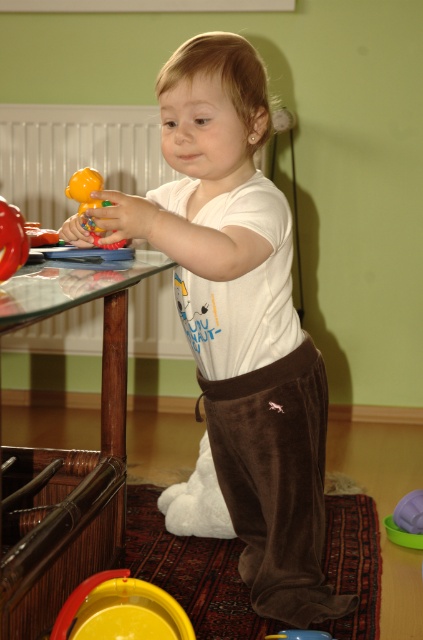
Question: Which point appears closest to the camera in this image?

Choices:
 (A) [82, 449]
 (B) [279, 637]
 (C) [183, 500]

Answer: (B)

Question: Can you confirm if transparent glass table at center is positioned to the left of smooth green ball at lower right?

Choices:
 (A) yes
 (B) no

Answer: (A)

Question: Is matte white radiator at left thinner than yellow plastic bucket at lower center?

Choices:
 (A) no
 (B) yes

Answer: (A)

Question: Among these objects, which one is farthest from the camera?

Choices:
 (A) matte white radiator at left
 (B) white soft t-shirt at center

Answer: (A)

Question: Which of these objects is positioned closest to the yellow plastic bucket at lower center?

Choices:
 (A) rubber red ball at left
 (B) matte yellow rubber duck at left

Answer: (A)

Question: Is white soft t-shirt at center thinner than yellow plastic bucket at lower center?

Choices:
 (A) yes
 (B) no

Answer: (B)